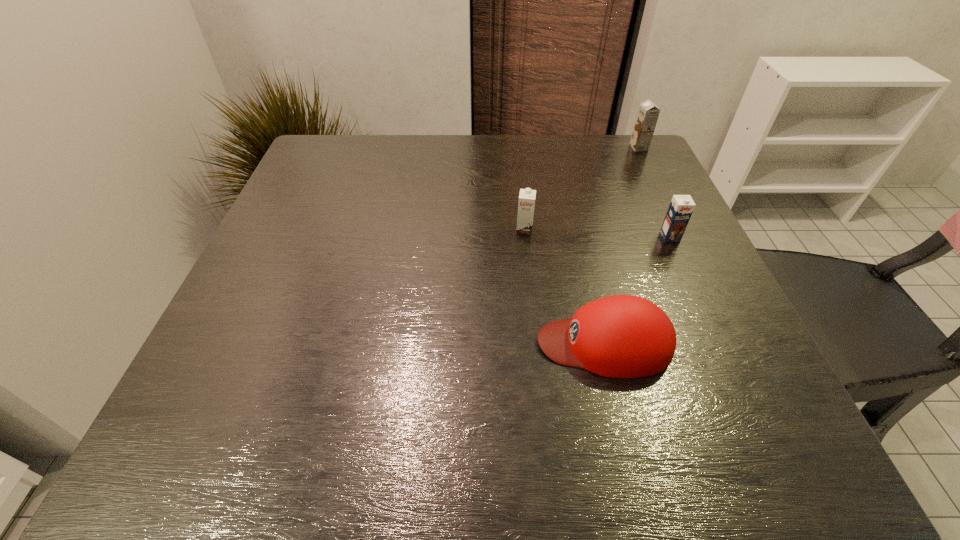
In order to click on baseball cap that is at the right edge in this screenshot , I will do `click(622, 336)`.

Where is `object at the far right corner`? object at the far right corner is located at coordinates (648, 113).

Identify the location of vacant area at the far edge of the desktop. This screenshot has height=540, width=960. (421, 166).

In the image, there is a desktop. In order to click on vacant space at the near edge in this screenshot , I will do `click(492, 445)`.

Locate an element on the screen. The image size is (960, 540). free space at the left edge of the desktop is located at coordinates (312, 290).

In the image, there is a desktop. At what (x,y) coordinates should I click in order to perform the action: click on vacant space at the right edge. Please return your answer as a coordinate pair (x, y). Looking at the image, I should click on (625, 227).

In the image, there is a desktop. At what (x,y) coordinates should I click in order to perform the action: click on free space at the far left corner. Please return your answer as a coordinate pair (x, y). Looking at the image, I should click on (321, 151).

You are a GUI agent. You are given a task and a screenshot of the screen. Output one action in this format:
    pyautogui.click(x=<x>, y=<y>)
    Task: Click on the free spot at the far right corner of the desktop
    Image resolution: width=960 pixels, height=540 pixels.
    Given the screenshot: What is the action you would take?
    pyautogui.click(x=610, y=144)

In the image, there is a desktop. Where is `vacant space at the near right corner`? The image size is (960, 540). vacant space at the near right corner is located at coordinates (694, 421).

Locate an element on the screen. The height and width of the screenshot is (540, 960). empty space between the farthest object and the baseball cap is located at coordinates (621, 245).